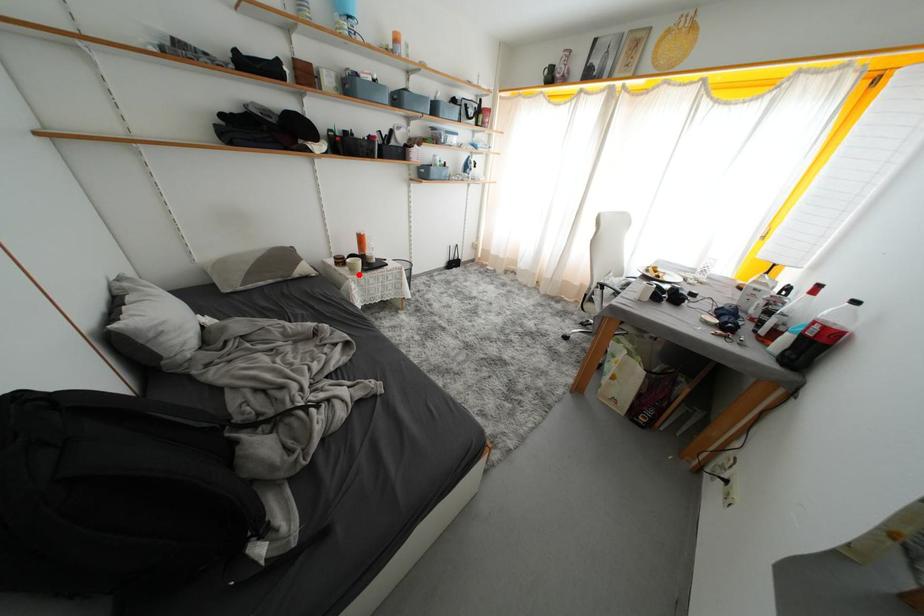
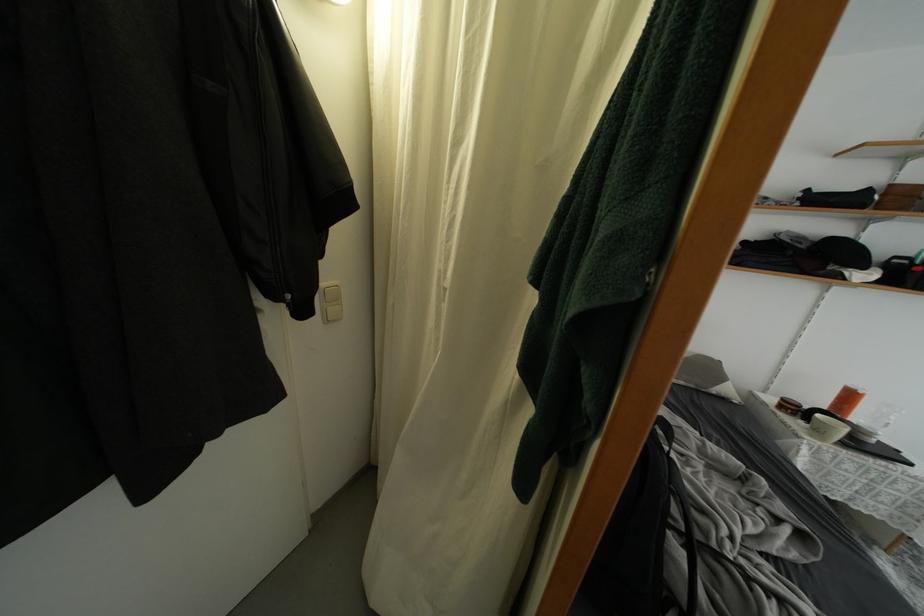
Question: I am providing you with two images of the same scene from different viewpoints. A red point is shown in image1. For the corresponding object point in image2, is it positioned nearer or farther from the camera?

Choices:
 (A) Nearer
 (B) Farther

Answer: (B)